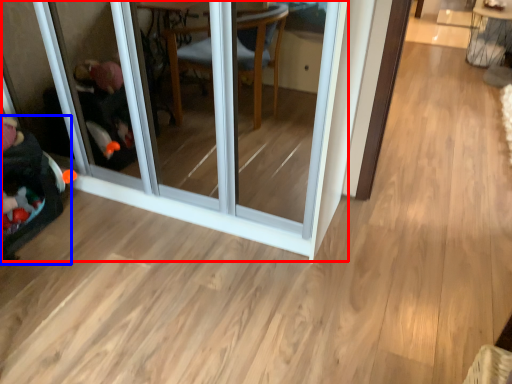
Question: Which object appears farthest to the camera in this image, screen door (highlighted by a red box) or baby carriage (highlighted by a blue box)?

Choices:
 (A) screen door
 (B) baby carriage

Answer: (B)